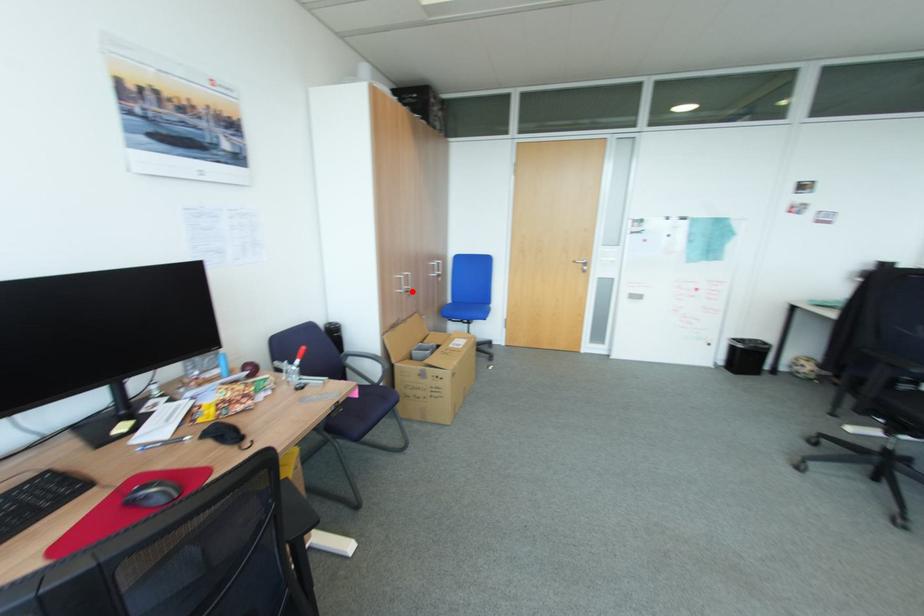
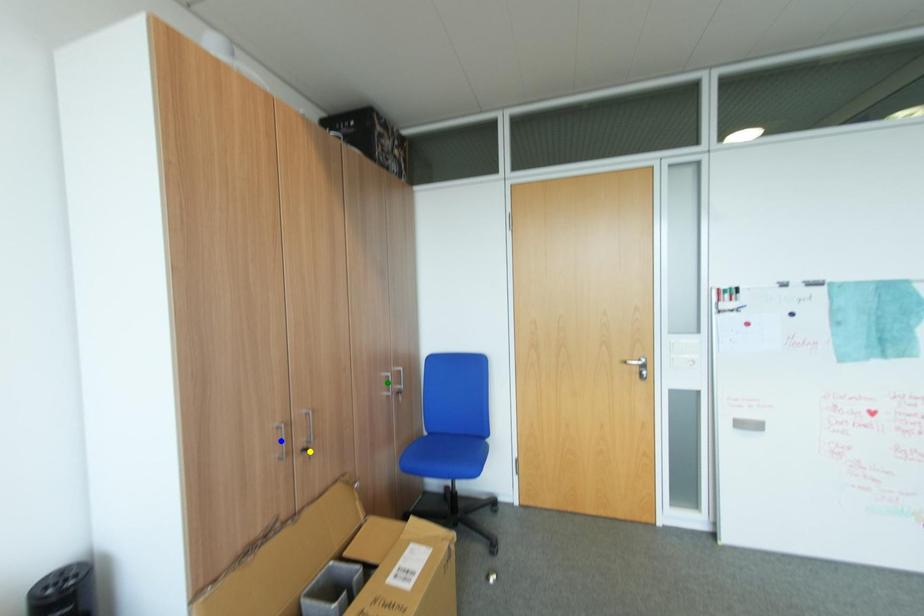
Question: I am providing you with two images of the same scene from different viewpoints. A red point is marked on the first image. You are given multiple points on the second image. Which spot in image 2 lines up with the point in image 1?

Choices:
 (A) yellow point
 (B) blue point
 (C) green point

Answer: (A)